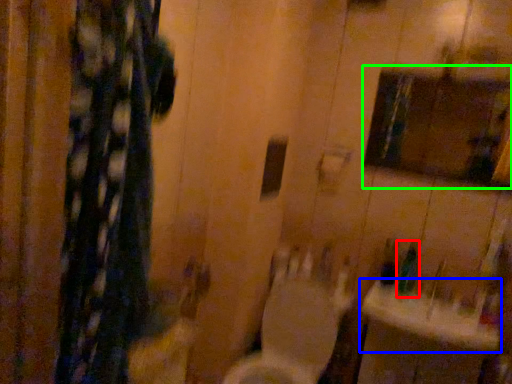
Question: Based on their relative distances, which object is farther from toiletry (highlighted by a red box)? Choose from sink (highlighted by a blue box) and medicine cabinet (highlighted by a green box).

Choices:
 (A) sink
 (B) medicine cabinet

Answer: (B)